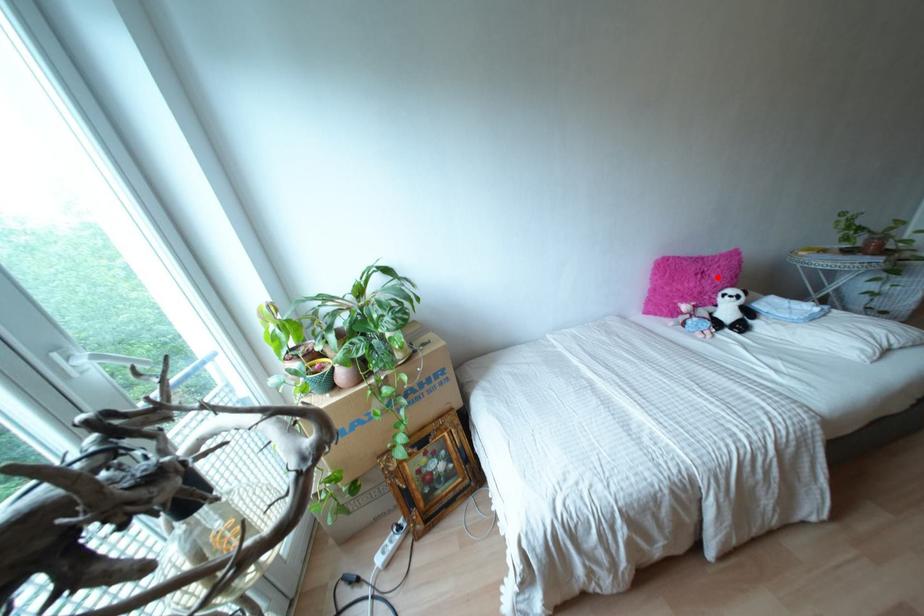
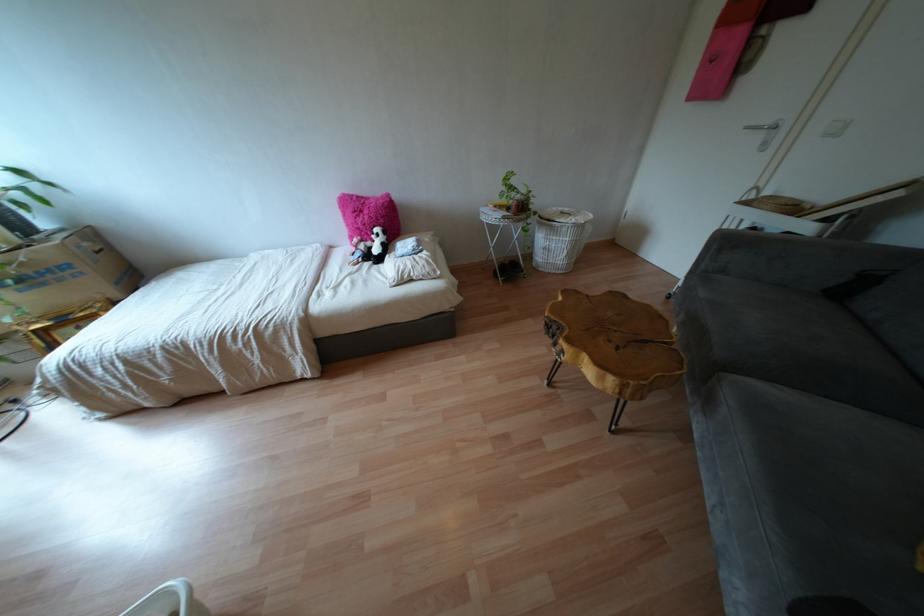
Question: I am providing you with two images of the same scene from different viewpoints. A red point is shown in image1. For the corresponding object point in image2, is it positioned nearer or farther from the camera?

Choices:
 (A) Nearer
 (B) Farther

Answer: (A)